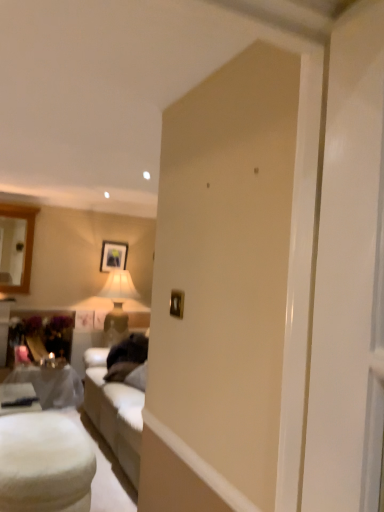
Question: Is metallic gold picture frame at center, placed as the 2th picture frame when sorted from left to right, positioned far away from matte black picture frame at upper center, positioned as the 2th picture frame in front-to-back order?

Choices:
 (A) yes
 (B) no

Answer: (A)

Question: From the image's perspective, is metallic gold picture frame at center, placed as the 2th picture frame when sorted from back to front, beneath matte black picture frame at upper center, positioned as the 2th picture frame in front-to-back order?

Choices:
 (A) no
 (B) yes

Answer: (B)

Question: From the image's perspective, is metallic gold picture frame at center, which is the first picture frame in right-to-left order, over matte black picture frame at upper center, the 1th picture frame from the back?

Choices:
 (A) no
 (B) yes

Answer: (A)

Question: From a real-world perspective, does metallic gold picture frame at center, placed as the 2th picture frame when sorted from back to front, sit lower than matte black picture frame at upper center, positioned as the 2th picture frame in front-to-back order?

Choices:
 (A) no
 (B) yes

Answer: (B)

Question: Considering the relative sizes of metallic gold picture frame at center, which is the first picture frame in right-to-left order, and matte black picture frame at upper center, positioned as the 2th picture frame in front-to-back order, in the image provided, is metallic gold picture frame at center, which is the first picture frame in right-to-left order, bigger than matte black picture frame at upper center, positioned as the 2th picture frame in front-to-back order,?

Choices:
 (A) yes
 (B) no

Answer: (B)

Question: From the image's perspective, is metallic gold picture frame at center, placed as the 2th picture frame when sorted from left to right, above or below matte black picture frame at upper center, which is the 1th picture frame in left-to-right order?

Choices:
 (A) above
 (B) below

Answer: (B)

Question: Would you say metallic gold picture frame at center, placed as the 2th picture frame when sorted from left to right, is to the left or to the right of matte black picture frame at upper center, the 1th picture frame from the back, in the picture?

Choices:
 (A) left
 (B) right

Answer: (B)

Question: Is metallic gold picture frame at center, which is the first picture frame in right-to-left order, inside or outside of matte black picture frame at upper center, which ranks as the 2th picture frame in right-to-left order?

Choices:
 (A) outside
 (B) inside

Answer: (A)

Question: Does point (175, 292) appear closer or farther from the camera than point (114, 266)?

Choices:
 (A) closer
 (B) farther

Answer: (A)

Question: In terms of width, does metallic gold picture frame at center, which is the first picture frame in right-to-left order, look wider or thinner when compared to white fluffy ottoman at lower left, which is counted as the 2th table, starting from the back?

Choices:
 (A) wide
 (B) thin

Answer: (B)

Question: Does point (173, 296) appear closer or farther from the camera than point (16, 464)?

Choices:
 (A) closer
 (B) farther

Answer: (A)

Question: From a real-world perspective, is metallic gold picture frame at center, placed as the 2th picture frame when sorted from left to right, positioned above or below white fluffy ottoman at lower left, which is the first table from front to back?

Choices:
 (A) above
 (B) below

Answer: (A)

Question: From the image's perspective, is metallic gold picture frame at center, which is the first picture frame in right-to-left order, positioned above or below white fluffy ottoman at lower left, which is the first table from front to back?

Choices:
 (A) below
 (B) above

Answer: (B)

Question: Is point (115, 262) closer or farther from the camera than point (178, 316)?

Choices:
 (A) closer
 (B) farther

Answer: (B)

Question: Is matte black picture frame at upper center, which is the 1th picture frame in left-to-right order, spatially inside metallic gold picture frame at center, placed as the 2th picture frame when sorted from left to right, or outside of it?

Choices:
 (A) outside
 (B) inside

Answer: (A)